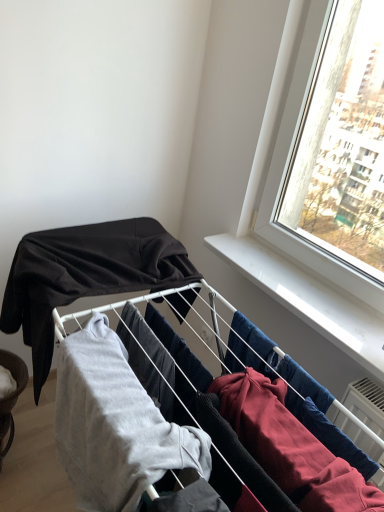
Measure the distance between light gray cotton sweatshirt at center, the 2th clothing viewed from the back, and camera.

A distance of 32.84 inches exists between light gray cotton sweatshirt at center, the 2th clothing viewed from the back, and camera.

What is the approximate height of matte black fabric at upper left, acting as the 1th clothing starting from the back?

matte black fabric at upper left, acting as the 1th clothing starting from the back, is 18.33 inches in height.

This screenshot has height=512, width=384. What are the coordinates of `light gray cotton sweatshirt at center, which is the 1th clothing from front to back` in the screenshot? It's located at (115, 424).

Locate an element on the screen. The height and width of the screenshot is (512, 384). clothing directly beneath the matte black fabric at upper left, the 2th clothing viewed from the front (from a real-world perspective) is located at coordinates (115, 424).

Would you say matte black fabric at upper left, the 2th clothing viewed from the front, is a long distance from light gray cotton sweatshirt at center, which is the 1th clothing from front to back?

They are positioned close to each other.

Based on their positions, is matte black fabric at upper left, acting as the 1th clothing starting from the back, located to the left or right of light gray cotton sweatshirt at center, the 2th clothing viewed from the back?

Clearly, matte black fabric at upper left, acting as the 1th clothing starting from the back, is on the left of light gray cotton sweatshirt at center, the 2th clothing viewed from the back, in the image.

Which is farther, (91,264) or (98,442)?

The point (91,264) is farther.

The width and height of the screenshot is (384, 512). I want to click on the 1st clothing positioned above the brushed metal bowl at lower left (from the image's perspective), so click(115, 424).

Between brushed metal bowl at lower left and light gray cotton sweatshirt at center, the 2th clothing viewed from the back, which one has smaller size?

With smaller size is brushed metal bowl at lower left.

Which object is closer to the camera, brushed metal bowl at lower left or light gray cotton sweatshirt at center, the 2th clothing viewed from the back?

light gray cotton sweatshirt at center, the 2th clothing viewed from the back.

Is brushed metal bowl at lower left oriented away from light gray cotton sweatshirt at center, which is the 1th clothing from front to back?

brushed metal bowl at lower left is not turned away from light gray cotton sweatshirt at center, which is the 1th clothing from front to back.

How many degrees apart are the facing directions of matte black fabric at upper left, the 2th clothing viewed from the front, and brushed metal bowl at lower left?

The angle between the facing direction of matte black fabric at upper left, the 2th clothing viewed from the front, and the facing direction of brushed metal bowl at lower left is 90.5 degrees.

From a real-world perspective, is matte black fabric at upper left, the 2th clothing viewed from the front, beneath brushed metal bowl at lower left?

No.

Is the position of matte black fabric at upper left, acting as the 1th clothing starting from the back, less distant than that of brushed metal bowl at lower left?

Yes, matte black fabric at upper left, acting as the 1th clothing starting from the back, is in front of brushed metal bowl at lower left.

Find the location of `furniture below the matte black fabric at upper left, the 2th clothing viewed from the front (from the image's perspective)`. furniture below the matte black fabric at upper left, the 2th clothing viewed from the front (from the image's perspective) is located at coordinates (11, 397).

In terms of size, does light gray cotton sweatshirt at center, the 2th clothing viewed from the back, appear bigger or smaller than matte black fabric at upper left, the 2th clothing viewed from the front?

In the image, light gray cotton sweatshirt at center, the 2th clothing viewed from the back, appears to be smaller than matte black fabric at upper left, the 2th clothing viewed from the front.

Between light gray cotton sweatshirt at center, which is the 1th clothing from front to back, and matte black fabric at upper left, the 2th clothing viewed from the front, which one has larger width?

Wider between the two is matte black fabric at upper left, the 2th clothing viewed from the front.

From the image's perspective, is light gray cotton sweatshirt at center, which is the 1th clothing from front to back, located above or below matte black fabric at upper left, the 2th clothing viewed from the front?

light gray cotton sweatshirt at center, which is the 1th clothing from front to back, is situated lower than matte black fabric at upper left, the 2th clothing viewed from the front, in the image.

Identify the location of clothing behind the light gray cotton sweatshirt at center, the 2th clothing viewed from the back. (85, 276).

Considering the relative sizes of light gray cotton sweatshirt at center, the 2th clothing viewed from the back, and brushed metal bowl at lower left in the image provided, is light gray cotton sweatshirt at center, the 2th clothing viewed from the back, shorter than brushed metal bowl at lower left?

In fact, light gray cotton sweatshirt at center, the 2th clothing viewed from the back, may be taller than brushed metal bowl at lower left.

Where is `furniture that appears below the light gray cotton sweatshirt at center, which is the 1th clothing from front to back (from a real-world perspective)`? Image resolution: width=384 pixels, height=512 pixels. furniture that appears below the light gray cotton sweatshirt at center, which is the 1th clothing from front to back (from a real-world perspective) is located at coordinates (11, 397).

Does light gray cotton sweatshirt at center, the 2th clothing viewed from the back, come in front of brushed metal bowl at lower left?

Yes, light gray cotton sweatshirt at center, the 2th clothing viewed from the back, is in front of brushed metal bowl at lower left.

Are light gray cotton sweatshirt at center, which is the 1th clothing from front to back, and brushed metal bowl at lower left beside each other?

No, light gray cotton sweatshirt at center, which is the 1th clothing from front to back, is not with brushed metal bowl at lower left.

Is brushed metal bowl at lower left situated inside matte black fabric at upper left, the 2th clothing viewed from the front, or outside?

brushed metal bowl at lower left is spatially situated outside matte black fabric at upper left, the 2th clothing viewed from the front.

How many degrees apart are the facing directions of brushed metal bowl at lower left and matte black fabric at upper left, acting as the 1th clothing starting from the back?

The angular difference between brushed metal bowl at lower left and matte black fabric at upper left, acting as the 1th clothing starting from the back, is 90.5 degrees.

At what (x,y) coordinates should I click in order to perform the action: click on the 1st clothing in front when counting from the brushed metal bowl at lower left. Please return your answer as a coordinate pair (x, y). Image resolution: width=384 pixels, height=512 pixels. Looking at the image, I should click on (85, 276).

Locate an element on the screen. clothing above the light gray cotton sweatshirt at center, the 2th clothing viewed from the back (from a real-world perspective) is located at coordinates (85, 276).

Locate an element on the screen. This screenshot has width=384, height=512. the 2nd clothing in front of the brushed metal bowl at lower left, counting from the anchor's position is located at coordinates (115, 424).

Looking at the image, which one is located closer to brushed metal bowl at lower left, matte black fabric at upper left, acting as the 1th clothing starting from the back, or light gray cotton sweatshirt at center, the 2th clothing viewed from the back?

matte black fabric at upper left, acting as the 1th clothing starting from the back, is closer to brushed metal bowl at lower left.

From the image, which object appears to be nearer to light gray cotton sweatshirt at center, the 2th clothing viewed from the back, matte black fabric at upper left, acting as the 1th clothing starting from the back, or brushed metal bowl at lower left?

matte black fabric at upper left, acting as the 1th clothing starting from the back, is positioned closer to the anchor light gray cotton sweatshirt at center, the 2th clothing viewed from the back.

Consider the image. When comparing their distances from matte black fabric at upper left, acting as the 1th clothing starting from the back, does brushed metal bowl at lower left or light gray cotton sweatshirt at center, which is the 1th clothing from front to back, seem closer?

light gray cotton sweatshirt at center, which is the 1th clothing from front to back.

Estimate the real-world distances between objects in this image. Which object is further from matte black fabric at upper left, the 2th clothing viewed from the front, light gray cotton sweatshirt at center, the 2th clothing viewed from the back, or brushed metal bowl at lower left?

The object further to matte black fabric at upper left, the 2th clothing viewed from the front, is brushed metal bowl at lower left.

Considering their positions, is light gray cotton sweatshirt at center, which is the 1th clothing from front to back, positioned closer to brushed metal bowl at lower left than matte black fabric at upper left, the 2th clothing viewed from the front?

matte black fabric at upper left, the 2th clothing viewed from the front, is closer to brushed metal bowl at lower left.

Based on the photo, which object lies nearer to the anchor point light gray cotton sweatshirt at center, which is the 1th clothing from front to back, brushed metal bowl at lower left or matte black fabric at upper left, the 2th clothing viewed from the front?

The object closer to light gray cotton sweatshirt at center, which is the 1th clothing from front to back, is matte black fabric at upper left, the 2th clothing viewed from the front.

Locate an element on the screen. clothing between light gray cotton sweatshirt at center, the 2th clothing viewed from the back, and brushed metal bowl at lower left, along the z-axis is located at coordinates (85, 276).